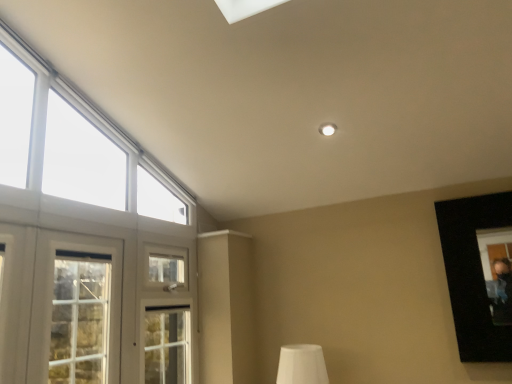
Find the location of a particular element. This screenshot has height=384, width=512. white matte table lamp at lower center is located at coordinates (302, 365).

Could white matte table lamp at lower center be considered to be inside white glass window at upper left, the second window ordered from the bottom?

No, white matte table lamp at lower center is located outside of white glass window at upper left, the second window ordered from the bottom.

Based on the photo, is white glass window at upper left, the second window ordered from the bottom, taller or shorter than white matte table lamp at lower center?

In the image, white glass window at upper left, the second window ordered from the bottom, appears to be taller than white matte table lamp at lower center.

Is white glass window at upper left, the first window positioned from the top, further to the viewer compared to white matte table lamp at lower center?

No, white glass window at upper left, the first window positioned from the top, is in front of white matte table lamp at lower center.

Can you tell me how much white glass window at upper left, the second window ordered from the bottom, and white wooden window at left, which ranks as the 1th window in bottom-to-top order, differ in facing direction?

white glass window at upper left, the second window ordered from the bottom, and white wooden window at left, which ranks as the 1th window in bottom-to-top order, are facing 0.00102 degrees away from each other.

Is white glass window at upper left, the first window positioned from the top, far from white wooden window at left, marked as the 2th window in a top-to-bottom arrangement?

That's right, there is a large distance between white glass window at upper left, the first window positioned from the top, and white wooden window at left, marked as the 2th window in a top-to-bottom arrangement.

Measure the distance from white glass window at upper left, the first window positioned from the top, to white wooden window at left, which ranks as the 1th window in bottom-to-top order.

A distance of 4.51 feet exists between white glass window at upper left, the first window positioned from the top, and white wooden window at left, which ranks as the 1th window in bottom-to-top order.

Does white glass window at upper left, the first window positioned from the top, have a lesser height compared to white wooden window at left, marked as the 2th window in a top-to-bottom arrangement?

No, white glass window at upper left, the first window positioned from the top, is not shorter than white wooden window at left, marked as the 2th window in a top-to-bottom arrangement.

From a real-world perspective, relative to white glass window at upper left, the second window ordered from the bottom, is white matte table lamp at lower center vertically above or below?

white matte table lamp at lower center is situated lower than white glass window at upper left, the second window ordered from the bottom, in the real world.

Considering the points (308, 374) and (85, 172), which point is behind, point (308, 374) or point (85, 172)?

The point (308, 374) is farther.

Is white matte table lamp at lower center touching white glass window at upper left, the second window ordered from the bottom?

No, white matte table lamp at lower center is not beside white glass window at upper left, the second window ordered from the bottom.

Between white matte table lamp at lower center and white glass window at upper left, the first window positioned from the top, which one appears on the right side from the viewer's perspective?

white matte table lamp at lower center.

From the image's perspective, is white wooden window at left, which ranks as the 1th window in bottom-to-top order, located above or below white glass window at upper left, the first window positioned from the top?

white wooden window at left, which ranks as the 1th window in bottom-to-top order, is below white glass window at upper left, the first window positioned from the top.

Considering the relative positions of white wooden window at left, which ranks as the 1th window in bottom-to-top order, and white glass window at upper left, the first window positioned from the top, in the image provided, is white wooden window at left, which ranks as the 1th window in bottom-to-top order, to the right of white glass window at upper left, the first window positioned from the top, from the viewer's perspective?

In fact, white wooden window at left, which ranks as the 1th window in bottom-to-top order, is to the left of white glass window at upper left, the first window positioned from the top.

In the image, is white wooden window at left, marked as the 2th window in a top-to-bottom arrangement, positioned in front of or behind white glass window at upper left, the first window positioned from the top?

In the image, white wooden window at left, marked as the 2th window in a top-to-bottom arrangement, appears behind white glass window at upper left, the first window positioned from the top.

Is white wooden window at left, marked as the 2th window in a top-to-bottom arrangement, inside or outside of white glass window at upper left, the first window positioned from the top?

white wooden window at left, marked as the 2th window in a top-to-bottom arrangement, is not enclosed by white glass window at upper left, the first window positioned from the top.

Who is bigger, white wooden window at left, marked as the 2th window in a top-to-bottom arrangement, or white matte table lamp at lower center?

white wooden window at left, marked as the 2th window in a top-to-bottom arrangement.

From the image's perspective, between white wooden window at left, marked as the 2th window in a top-to-bottom arrangement, and white matte table lamp at lower center, which one is located above?

white wooden window at left, marked as the 2th window in a top-to-bottom arrangement, appears higher in the image.

How different are the orientations of white wooden window at left, which ranks as the 1th window in bottom-to-top order, and white matte table lamp at lower center in degrees?

They differ by 43.7 degrees in their facing directions.

Looking at this image, considering the sizes of objects white wooden window at left, which ranks as the 1th window in bottom-to-top order, and white matte table lamp at lower center in the image provided, who is thinner, white wooden window at left, which ranks as the 1th window in bottom-to-top order, or white matte table lamp at lower center?

With smaller width is white wooden window at left, which ranks as the 1th window in bottom-to-top order.

Considering the positions of point (282, 371) and point (41, 300), is point (282, 371) closer or farther from the camera than point (41, 300)?

Clearly, point (282, 371) is more distant from the camera than point (41, 300).

From a real-world perspective, is white matte table lamp at lower center on white wooden window at left, marked as the 2th window in a top-to-bottom arrangement?

No.

Locate an element on the screen. The image size is (512, 384). window that is the 1st one when counting forward from the white matte table lamp at lower center is located at coordinates (76, 310).

Who is taller, white matte table lamp at lower center or white wooden window at left, marked as the 2th window in a top-to-bottom arrangement?

Standing taller between the two is white wooden window at left, marked as the 2th window in a top-to-bottom arrangement.

Locate an element on the screen. This screenshot has height=384, width=512. table lamp below the white glass window at upper left, the first window positioned from the top (from a real-world perspective) is located at coordinates (302, 365).

Find the location of a particular element. window positioned vertically above the white wooden window at left, marked as the 2th window in a top-to-bottom arrangement (from a real-world perspective) is located at coordinates (87, 242).

Which object lies nearer to the anchor point white wooden window at left, marked as the 2th window in a top-to-bottom arrangement, white glass window at upper left, the second window ordered from the bottom, or white matte table lamp at lower center?

white glass window at upper left, the second window ordered from the bottom, lies closer to white wooden window at left, marked as the 2th window in a top-to-bottom arrangement, than the other object.

When comparing their distances from white wooden window at left, which ranks as the 1th window in bottom-to-top order, does white matte table lamp at lower center or white glass window at upper left, the first window positioned from the top, seem closer?

white glass window at upper left, the first window positioned from the top.

Looking at the image, which one is located further to white matte table lamp at lower center, white glass window at upper left, the first window positioned from the top, or white wooden window at left, which ranks as the 1th window in bottom-to-top order?

white wooden window at left, which ranks as the 1th window in bottom-to-top order, is positioned further to the anchor white matte table lamp at lower center.

In the scene shown: Based on their spatial positions, is white wooden window at left, which ranks as the 1th window in bottom-to-top order, or white matte table lamp at lower center further from white glass window at upper left, the first window positioned from the top?

white wooden window at left, which ranks as the 1th window in bottom-to-top order, lies further to white glass window at upper left, the first window positioned from the top, than the other object.

Which object lies further to the anchor point white glass window at upper left, the second window ordered from the bottom, white matte table lamp at lower center or white wooden window at left, marked as the 2th window in a top-to-bottom arrangement?

Among the two, white wooden window at left, marked as the 2th window in a top-to-bottom arrangement, is located further to white glass window at upper left, the second window ordered from the bottom.

Based on their spatial positions, is white wooden window at left, which ranks as the 1th window in bottom-to-top order, or white glass window at upper left, the first window positioned from the top, closer to white matte table lamp at lower center?

white glass window at upper left, the first window positioned from the top.

Locate an element on the screen. This screenshot has height=384, width=512. window that lies between white glass window at upper left, the second window ordered from the bottom, and white matte table lamp at lower center from top to bottom is located at coordinates (76, 310).